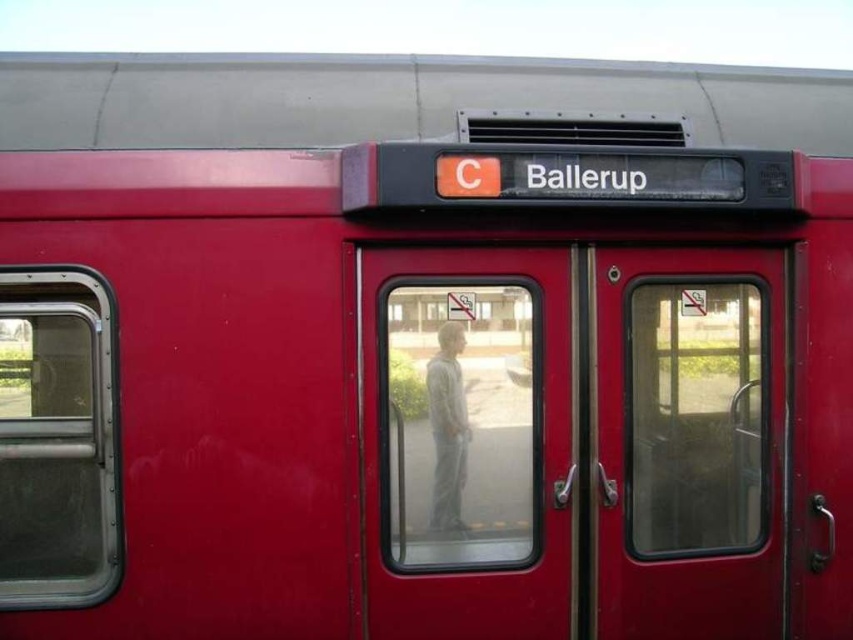
You are a passenger trying to board the train and see two doors at the center. The transparent glass door at center and the matte glass door at center. Which door should you use to enter the train?

The transparent glass door at center has a larger size compared to matte glass door at center, so you should use the transparent glass door at center to enter the train as it is more accessible and likely the operational entrance.

You are a passenger standing on the train platform and see the transparent glass door at center. Can you reach the door without stepping onto the train tracks? The platform is 2 meters wide.

The transparent glass door at center is 2.60 meters away from the viewer. Since the platform is only 2 meters wide, the distance between the viewer and the door exceeds the platform width. Therefore, the viewer cannot reach the door without stepping onto the train tracks.

You are standing at the point marked as point (373, 426) on the train. You want to reach the front door area, which is directly in front of you. If your walking speed is 1.5 meters per second, how many seconds will it take you to reach the door?

The distance between point (373, 426) and the viewer is 2.63 meters. Since you are moving towards the door at 1.5 meters per second, it will take approximately 1.75 seconds to reach the door.